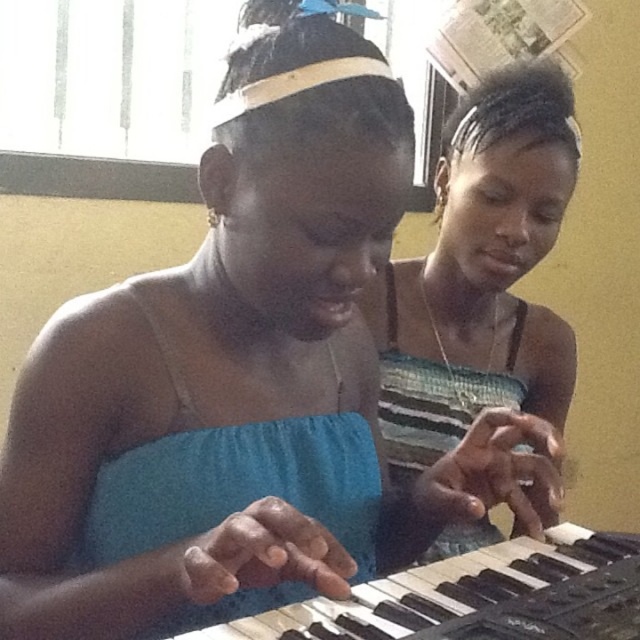
You are designing a stage setup where the striped fabric dress at center and the black plastic keyboard at center must be placed on a platform. If the platform can only accommodate items with a width of up to 1 meter, will both items fit side by side?

The striped fabric dress at center has a lesser width compared to black plastic keyboard at center. Since the total width of both items combined would exceed the platform limit of 1 meter, they cannot fit side by side.

You are a photographer setting up for a photoshoot. You need to place a light source between the striped fabric dress at center and the black plastic keyboard at center. Since you want the light to evenly illuminate both subjects, which object should you position closer to the light source?

The striped fabric dress at center is larger in size than the black plastic keyboard at center, so you should position the striped fabric dress at center closer to the light source to ensure even illumination.

You are a photographer setting up for a photoshoot. You need to position a light to the left of the striped fabric dress at center and another light to the right of the black plastic keyboard at center. Will the two lights be placed on the same side relative to the keyboard?

The striped fabric dress at center is to the right of the black plastic keyboard at center. Placing a light to the left of the striped fabric dress at center would be to the left of the dress, which is already on the right side of the keyboard. The other light is to the right of the keyboard. Therefore, the two lights will not be on the same side relative to the keyboard.